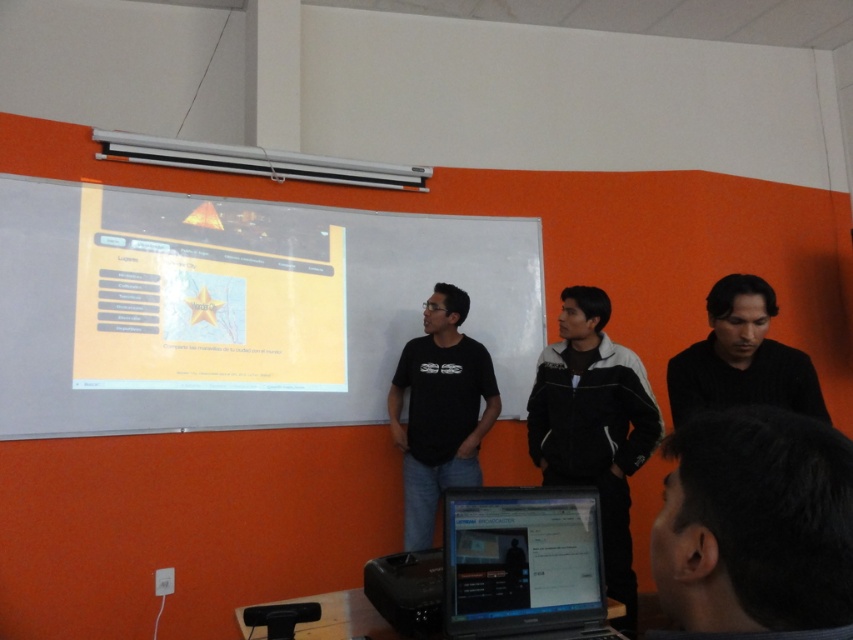
Which is more to the right, black sweater at right or black plastic projector at lower center?

black sweater at right

This screenshot has height=640, width=853. Find the location of `black sweater at right`. black sweater at right is located at coordinates (741, 358).

Can you confirm if dark gray hair at upper right is positioned above black glossy laptop at center?

Yes.

Which of these two, dark gray hair at upper right or black glossy laptop at center, stands shorter?

With less height is dark gray hair at upper right.

You are a GUI agent. You are given a task and a screenshot of the screen. Output one action in this format:
    pyautogui.click(x=<x>, y=<y>)
    Task: Click on the dark gray hair at upper right
    The width and height of the screenshot is (853, 640).
    Given the screenshot: What is the action you would take?
    pyautogui.click(x=755, y=525)

The width and height of the screenshot is (853, 640). Find the location of `dark gray hair at upper right`. dark gray hair at upper right is located at coordinates (755, 525).

Can you confirm if black glossy laptop at center is taller than black and white jacket at center?

In fact, black glossy laptop at center may be shorter than black and white jacket at center.

Is point (558, 580) closer to viewer compared to point (631, 378)?

Yes, it is.

Between point (456, 532) and point (596, 368), which one is positioned behind?

The point (596, 368) is behind.

Find the location of a particular element. black glossy laptop at center is located at coordinates [523, 563].